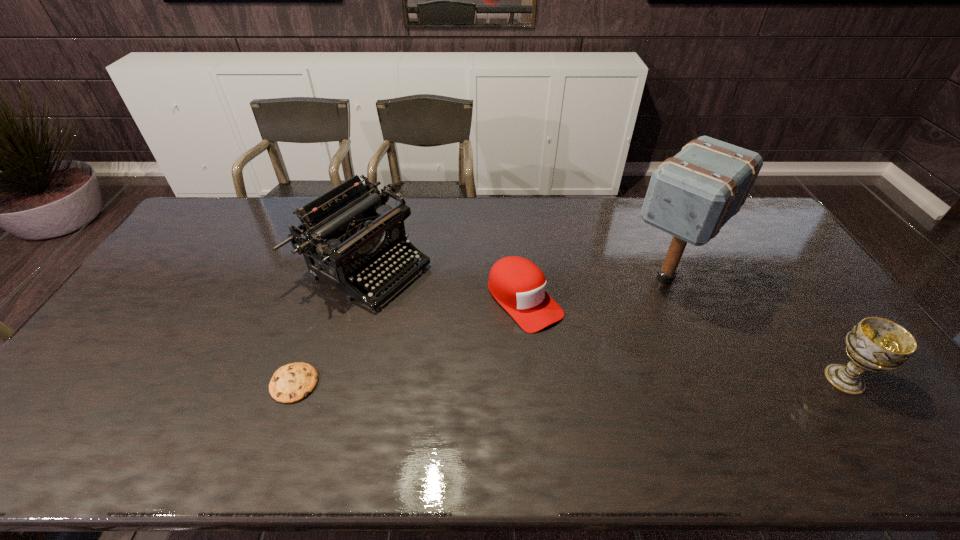
Image resolution: width=960 pixels, height=540 pixels. I want to click on blank region between the shortest object and the fourth tallest object, so click(410, 342).

The image size is (960, 540). Find the location of `free spot between the shortest object and the second shortest object`. free spot between the shortest object and the second shortest object is located at coordinates (410, 342).

Find the location of `vacant space that is in between the cookie and the third shortest object`. vacant space that is in between the cookie and the third shortest object is located at coordinates (569, 381).

Locate an element on the screen. This screenshot has width=960, height=540. empty location between the shortest object and the second shortest object is located at coordinates (410, 342).

The width and height of the screenshot is (960, 540). Find the location of `vacant point located between the shortest object and the rightmost object`. vacant point located between the shortest object and the rightmost object is located at coordinates (569, 381).

Image resolution: width=960 pixels, height=540 pixels. What are the coordinates of `free space between the typewriter and the third tallest object` in the screenshot? It's located at (606, 322).

Identify the location of free spot between the fourth tallest object and the tallest object. (595, 289).

Identify the location of free space between the typewriter and the third tallest object. The width and height of the screenshot is (960, 540). (606, 322).

Point out which object is positioned as the second nearest to the baseball cap. Please provide its 2D coordinates. Your answer should be formatted as a tuple, i.e. [(x, y)], where the tuple contains the x and y coordinates of a point satisfying the conditions above.

[(692, 195)]

I want to click on object that ranks as the second closest to the typewriter, so click(x=518, y=285).